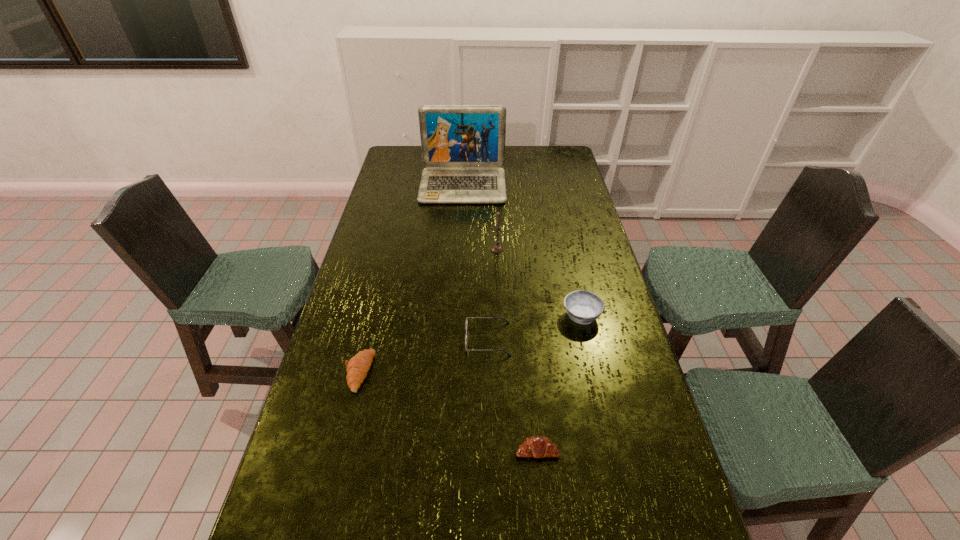
Find the location of a particular element. The image size is (960, 540). object that is at the right edge is located at coordinates (584, 307).

The height and width of the screenshot is (540, 960). In the image, there is a desktop. Identify the location of vacant area at the far edge. (530, 167).

Image resolution: width=960 pixels, height=540 pixels. What are the coordinates of `vacant space at the left edge` in the screenshot? It's located at (336, 376).

In the image, there is a desktop. What are the coordinates of `vacant space at the right edge` in the screenshot? It's located at (637, 467).

This screenshot has height=540, width=960. I want to click on vacant space at the far right corner of the desktop, so click(x=558, y=148).

The height and width of the screenshot is (540, 960). Identify the location of empty space that is in between the candle and the farthest object. (480, 218).

At what (x,y) coordinates should I click in order to perform the action: click on vacant region between the ashtray and the taller crescent roll. Please return your answer as a coordinate pair (x, y). Image resolution: width=960 pixels, height=540 pixels. Looking at the image, I should click on (470, 343).

I want to click on unoccupied area between the fifth nearest object and the sunglasses, so click(x=492, y=294).

Find the location of a particular element. This screenshot has width=960, height=540. blank region between the left crescent roll and the candle is located at coordinates (428, 310).

Locate an element on the screen. unoccupied area between the third tallest object and the laptop computer is located at coordinates (522, 251).